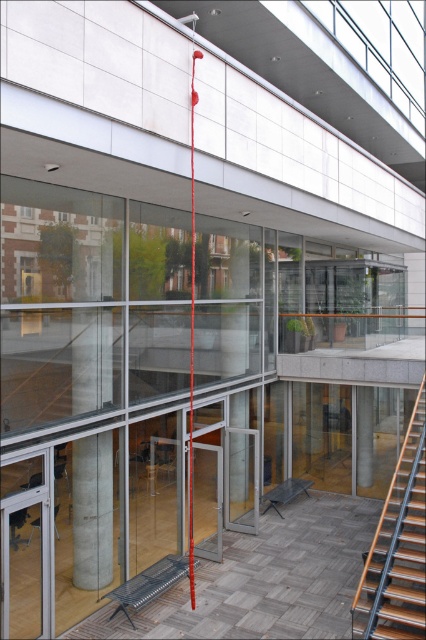
Question: Observing the image, what is the correct spatial positioning of wooden at right in reference to metallic red balustrade at lower center?

Choices:
 (A) above
 (B) below

Answer: (A)

Question: Which point is farther to the camera?

Choices:
 (A) (382, 636)
 (B) (131, 602)

Answer: (B)

Question: Which point is closer to the camera taking this photo?

Choices:
 (A) (425, 477)
 (B) (193, 563)

Answer: (A)

Question: Is wooden at right thinner than metallic red balustrade at lower center?

Choices:
 (A) no
 (B) yes

Answer: (A)

Question: Is wooden at right to the left of metallic red balustrade at lower center from the viewer's perspective?

Choices:
 (A) yes
 (B) no

Answer: (B)